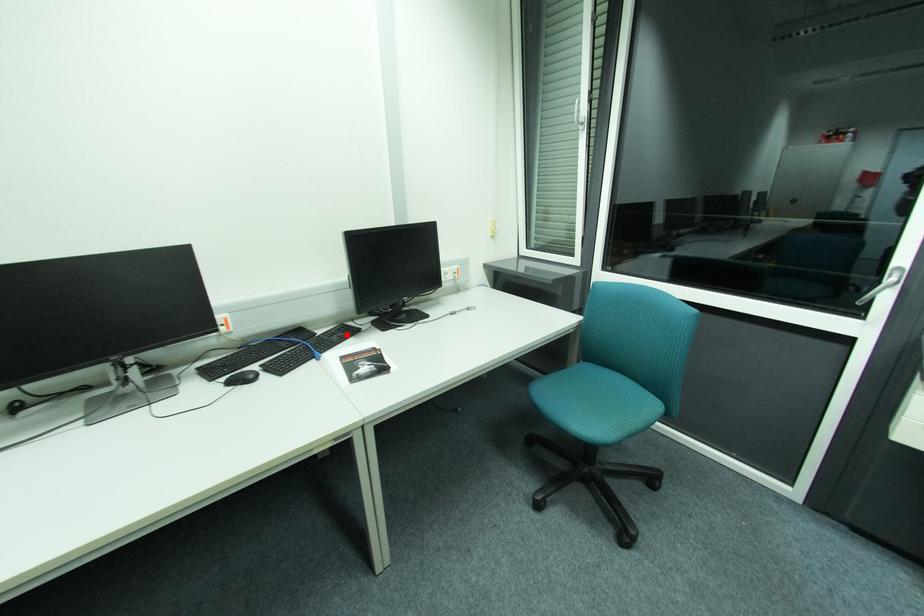
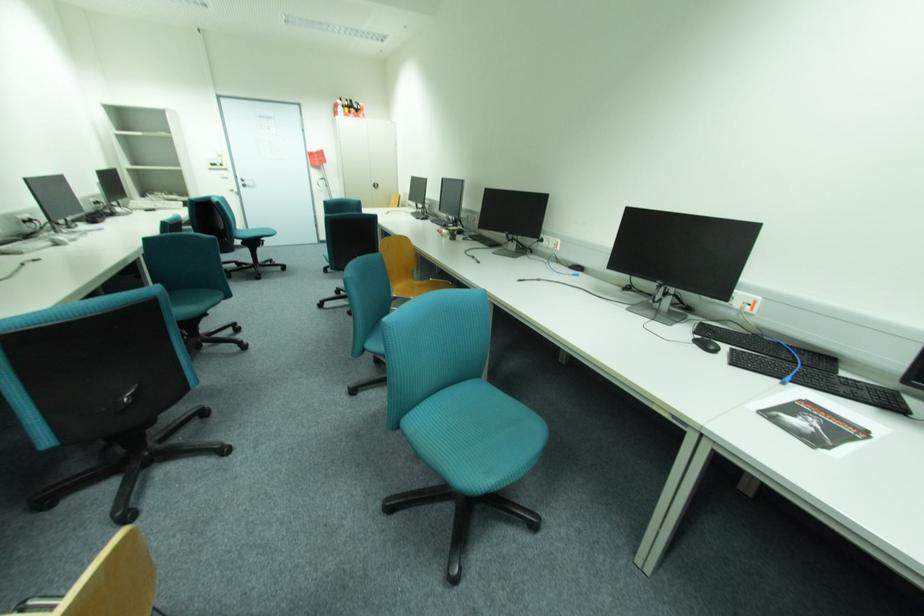
Locate, in the second image, the point that corresponds to the highlighted location in the first image.

(870, 392)